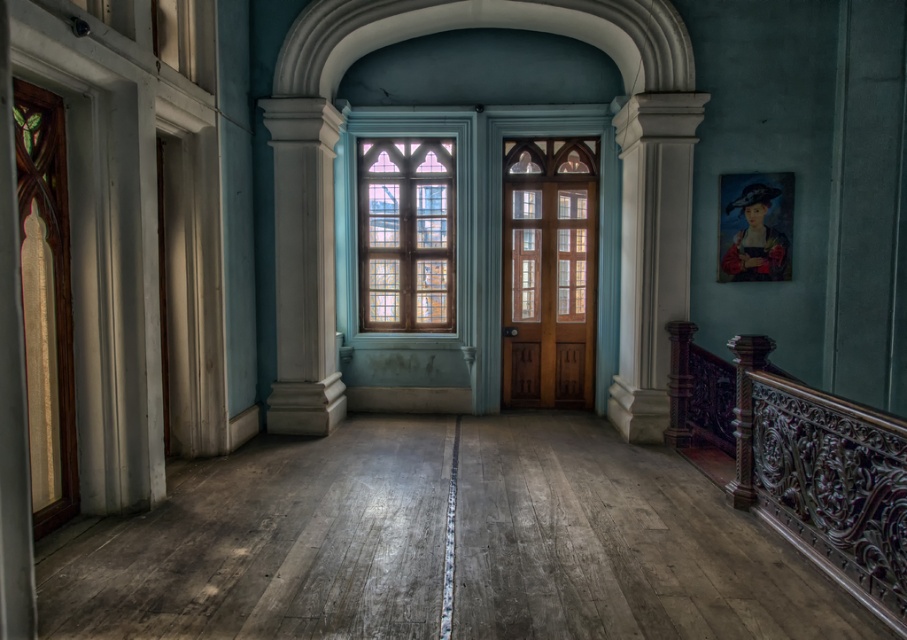
You are an interior designer planning to place a decorative vase between the dark wood carved railing at right and the wooden door at center. Based on their widths, which object should you place the vase closer to to ensure it doesn not topple over?

The dark wood carved railing at right is thinner than the wooden door at center, so placing the vase closer to the wooden door at center would provide a wider and more stable base to prevent it from toppling over.

You are a visitor standing in the hallway and want to walk towards the stained glass window at center. Is the dark wood carved railing at right in your way?

The dark wood carved railing at right is bigger than the stained glass window at center, so it is likely blocking your path to the stained glass window at center.